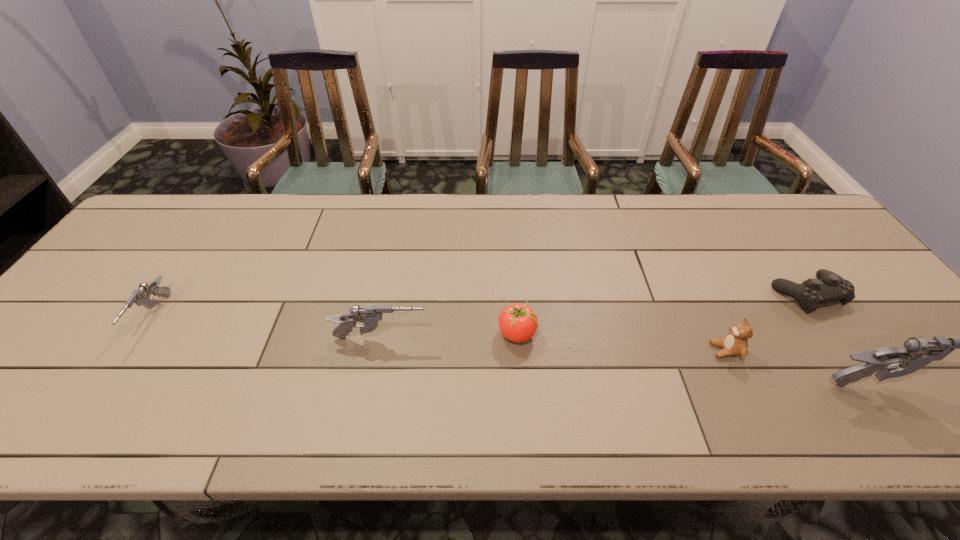
Find the location of a particular element. This screenshot has height=540, width=960. vacant area at the near right corner of the desktop is located at coordinates (944, 377).

Where is `free space between the second gun from right to left and the teddy bear`? This screenshot has height=540, width=960. free space between the second gun from right to left and the teddy bear is located at coordinates (553, 345).

The width and height of the screenshot is (960, 540). Identify the location of unoccupied position between the leftmost gun and the second object from left to right. (267, 328).

Where is `empty location between the fourth object from right to left and the leftmost gun`? The width and height of the screenshot is (960, 540). empty location between the fourth object from right to left and the leftmost gun is located at coordinates (335, 326).

The height and width of the screenshot is (540, 960). I want to click on free space that is in between the second tallest gun and the third object from right to left, so click(553, 345).

Find the location of a particular element. The height and width of the screenshot is (540, 960). free space between the shortest object and the second object from left to right is located at coordinates (593, 316).

Where is `blank region between the shortest object and the leftmost gun`? blank region between the shortest object and the leftmost gun is located at coordinates (480, 306).

You are a GUI agent. You are given a task and a screenshot of the screen. Output one action in this format:
    pyautogui.click(x=<x>, y=<y>)
    Task: Click on the unoccupied position between the shortest gun and the second gun from left to right
    This screenshot has width=960, height=540.
    Given the screenshot: What is the action you would take?
    pyautogui.click(x=267, y=328)

Locate an element on the screen. The width and height of the screenshot is (960, 540). free area in between the leftmost object and the second tallest gun is located at coordinates (267, 328).

The width and height of the screenshot is (960, 540). I want to click on free space between the fourth object from left to right and the shortest object, so click(766, 322).